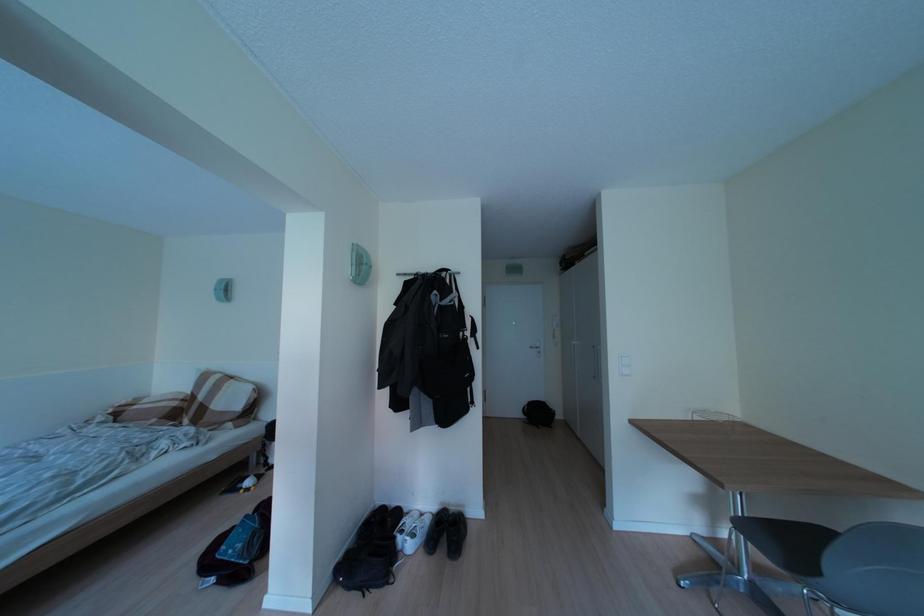
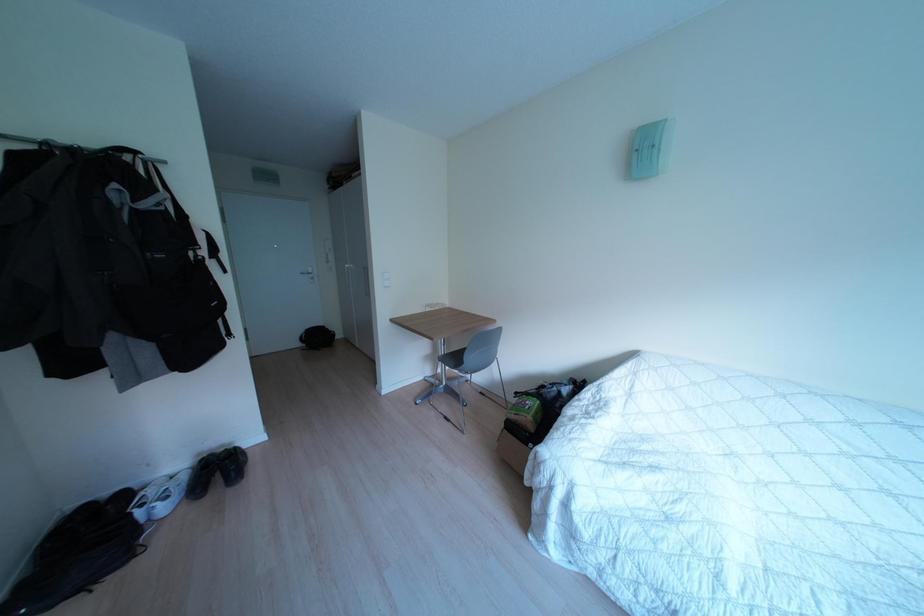
The first image is from the beginning of the video and the second image is from the end. How did the camera likely rotate when shooting the video?

The camera's rotation is toward right-down.